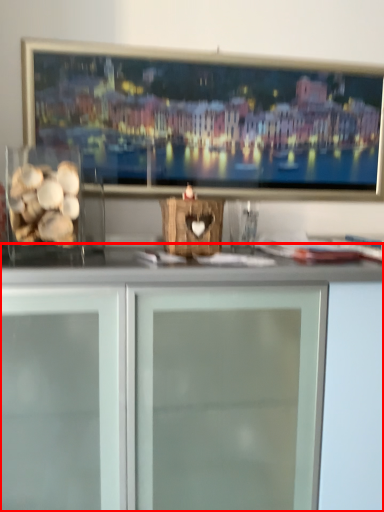
Question: From the image's perspective, where is cabinetry (annotated by the red box) located relative to food?

Choices:
 (A) below
 (B) above

Answer: (A)